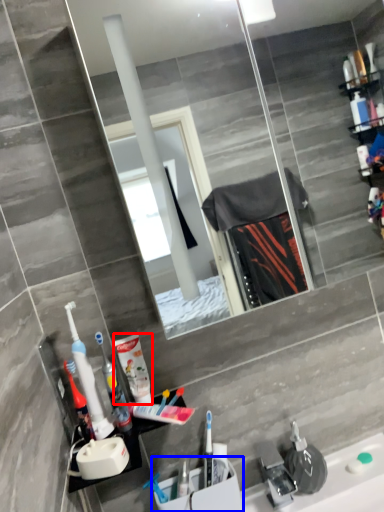
Question: Which object is closer to the camera taking this photo, cleaning product (highlighted by a red box) or sink (highlighted by a blue box)?

Choices:
 (A) cleaning product
 (B) sink

Answer: (A)